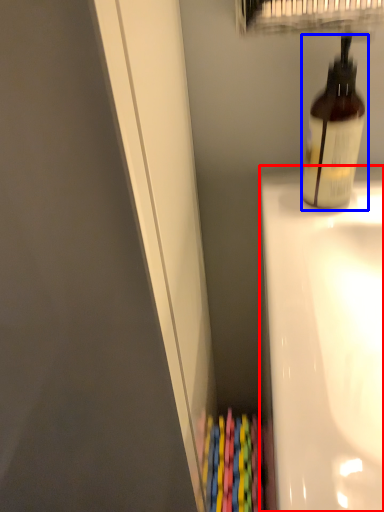
Question: Which point is further to the camera, bath (highlighted by a red box) or bottle (highlighted by a blue box)?

Choices:
 (A) bath
 (B) bottle

Answer: (B)